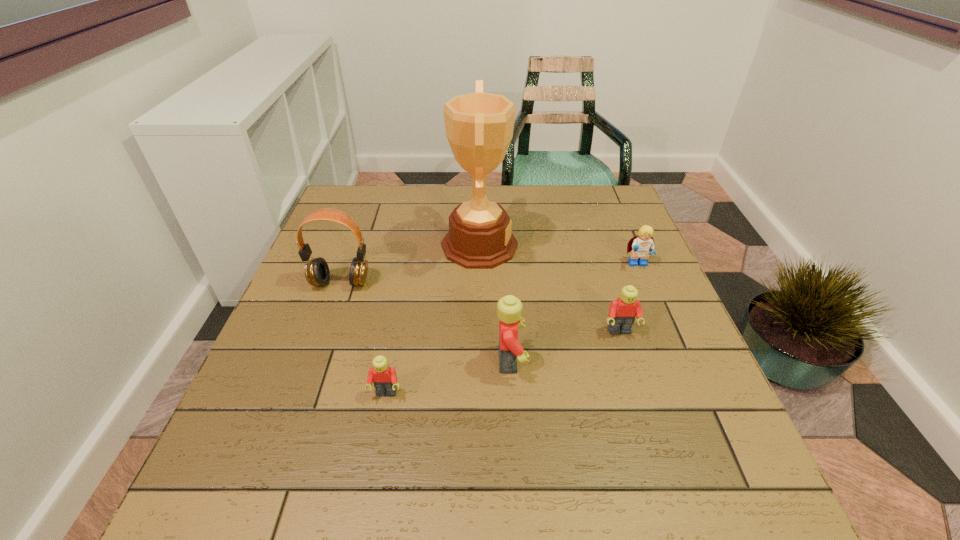
I want to click on free space at the right edge, so click(605, 231).

Where is `vacant space at the far left corner`? This screenshot has height=540, width=960. vacant space at the far left corner is located at coordinates (353, 205).

The image size is (960, 540). What are the coordinates of `vacant space at the near left corner of the desktop` in the screenshot? It's located at (281, 409).

This screenshot has width=960, height=540. In the image, there is a desktop. Identify the location of vacant space at the far right corner. (579, 200).

At what (x,y) coordinates should I click in order to perform the action: click on unoccupied area between the headset and the second nearest Lego. Please return your answer as a coordinate pair (x, y). This screenshot has height=540, width=960. Looking at the image, I should click on (425, 321).

You are a GUI agent. You are given a task and a screenshot of the screen. Output one action in this format:
    pyautogui.click(x=<x>, y=<y>)
    Task: Click on the free space between the leftmost object and the tallest Lego
    
    Given the screenshot: What is the action you would take?
    (x=425, y=321)

This screenshot has height=540, width=960. Identify the location of free space between the fourth farthest object and the tallest object. (549, 288).

Locate an element on the screen. The height and width of the screenshot is (540, 960). free space between the tallest Lego and the rightmost object is located at coordinates 574,313.

Where is `free space between the tallest object and the farthest Lego`? The width and height of the screenshot is (960, 540). free space between the tallest object and the farthest Lego is located at coordinates (559, 255).

The image size is (960, 540). I want to click on free area in between the award and the shortest object, so click(433, 320).